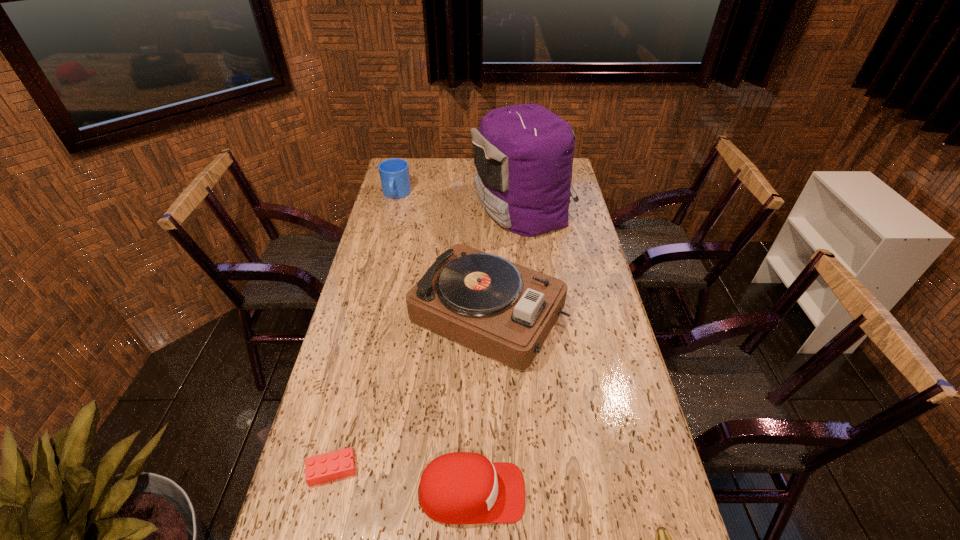
Locate an element on the screen. This screenshot has width=960, height=540. blank space at the right edge of the desktop is located at coordinates (579, 391).

Identify the location of vacant region at the far left corner. The width and height of the screenshot is (960, 540). (406, 159).

You are a GUI agent. You are given a task and a screenshot of the screen. Output one action in this format:
    pyautogui.click(x=<x>, y=<y>)
    Task: Click on the empty location between the backpack and the Lego
    Image resolution: width=960 pixels, height=540 pixels.
    Given the screenshot: What is the action you would take?
    pyautogui.click(x=427, y=339)

Identify the location of free space between the tallest object and the Lego. (427, 339).

Where is `free spot between the tallest object and the fourth shortest object`? This screenshot has height=540, width=960. free spot between the tallest object and the fourth shortest object is located at coordinates (460, 201).

Where is `blank region between the Lego and the tallest object`? This screenshot has height=540, width=960. blank region between the Lego and the tallest object is located at coordinates (427, 339).

Identify which object is located as the nearest to the Lego. Please provide its 2D coordinates. Your answer should be formatted as a tuple, i.e. [(x, y)], where the tuple contains the x and y coordinates of a point satisfying the conditions above.

[(457, 488)]

I want to click on the third closest object to the screwdriver, so click(339, 464).

Where is `vacant space that satisfies the following two spatial constraints: 1. on the side of the Lego with the handle; 2. on the right side of the mug`? Image resolution: width=960 pixels, height=540 pixels. vacant space that satisfies the following two spatial constraints: 1. on the side of the Lego with the handle; 2. on the right side of the mug is located at coordinates 326,470.

Locate an element on the screen. vacant area that satisfies the following two spatial constraints: 1. on the back side of the Lego; 2. on the left side of the record player is located at coordinates (371, 312).